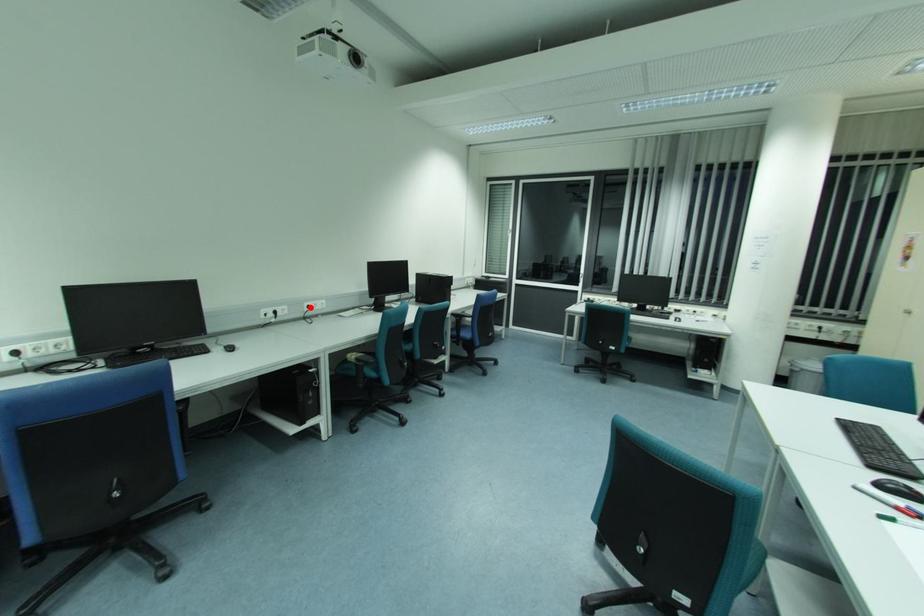
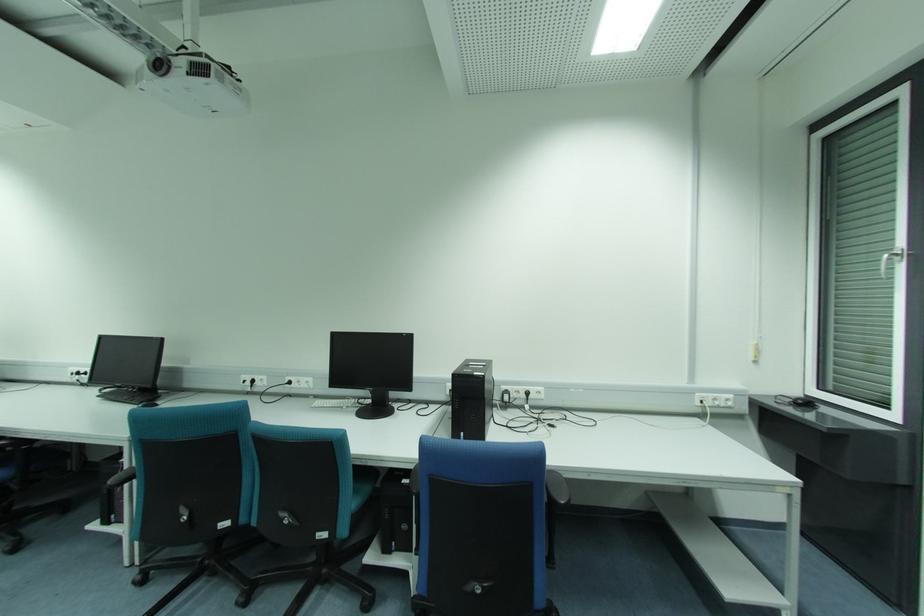
The point at the highlighted location is marked in the first image. Where is the corresponding point in the second image?

(289, 383)